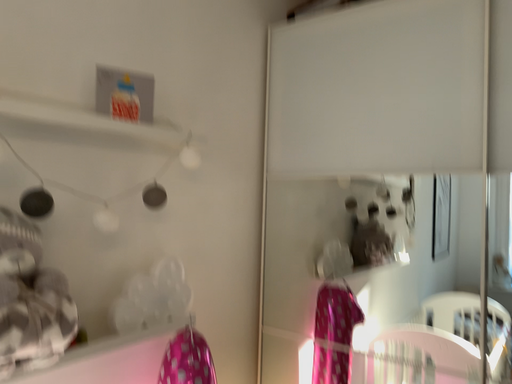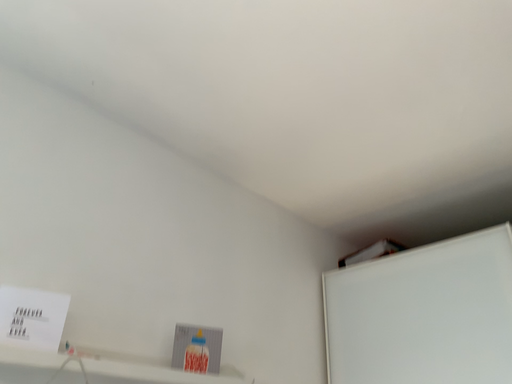
Question: How did the camera likely rotate when shooting the video?

Choices:
 (A) rotated right
 (B) rotated left

Answer: (B)